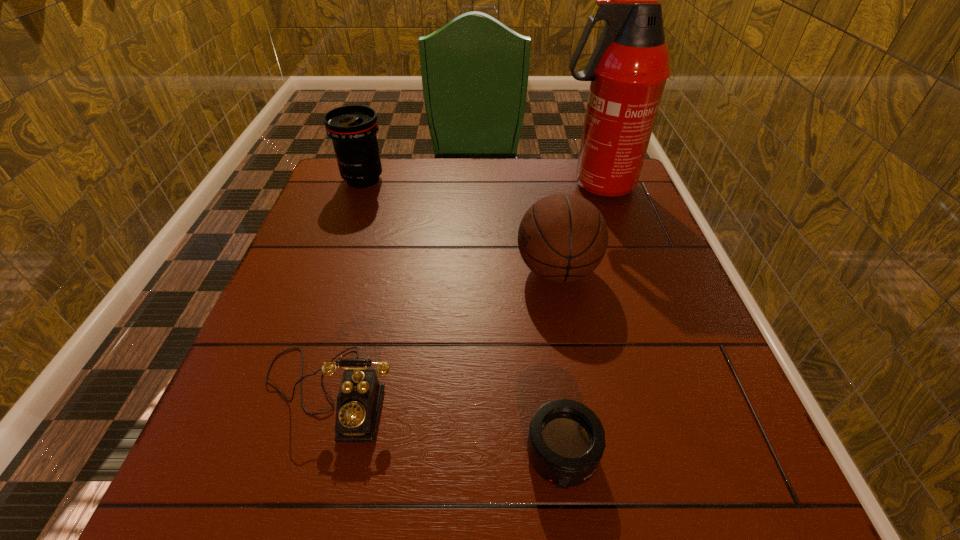
Image resolution: width=960 pixels, height=540 pixels. Identify the location of object located at the right edge. (628, 69).

The width and height of the screenshot is (960, 540). What are the coordinates of `object that is at the far left corner` in the screenshot? It's located at (352, 128).

Where is `object located in the far right corner section of the desktop`? The image size is (960, 540). object located in the far right corner section of the desktop is located at coordinates (628, 69).

In the image, there is a desktop. Identify the location of free region at the far edge. The height and width of the screenshot is (540, 960). (451, 196).

The height and width of the screenshot is (540, 960). Identify the location of vacant region at the near edge of the desktop. (647, 516).

Where is `vacant space at the left edge`? vacant space at the left edge is located at coordinates (279, 320).

Where is `blank space at the right edge`? The height and width of the screenshot is (540, 960). blank space at the right edge is located at coordinates [x=682, y=355].

This screenshot has height=540, width=960. What are the coordinates of `vacant area at the near left corner` in the screenshot? It's located at (263, 486).

The image size is (960, 540). What are the coordinates of `free space between the shorter telephoto lens and the tallest object` in the screenshot? It's located at (579, 320).

Where is `vacant point located between the fire extinguisher and the taller telephoto lens`? vacant point located between the fire extinguisher and the taller telephoto lens is located at coordinates (480, 182).